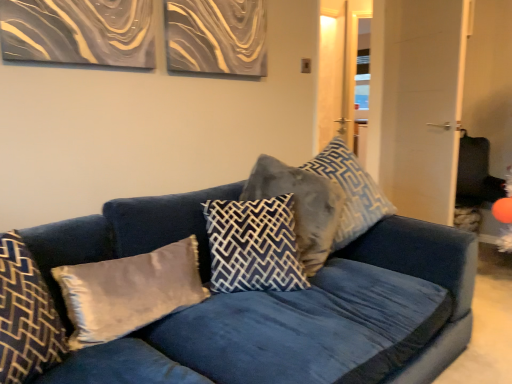
Question: Is velvet blue couch at center aimed at dark blue velvet pillow at center, which is the third pillow in left-to-right order?

Choices:
 (A) yes
 (B) no

Answer: (A)

Question: Is there a large distance between velvet blue couch at center and dark blue velvet pillow at center, the 3th pillow in the right-to-left sequence?

Choices:
 (A) yes
 (B) no

Answer: (B)

Question: Does velvet blue couch at center come in front of dark blue velvet pillow at center, the 3th pillow in the right-to-left sequence?

Choices:
 (A) no
 (B) yes

Answer: (B)

Question: Can you confirm if velvet blue couch at center is wider than dark blue velvet pillow at center, which is the third pillow in left-to-right order?

Choices:
 (A) yes
 (B) no

Answer: (A)

Question: From the image's perspective, would you say velvet blue couch at center is shown under dark blue velvet pillow at center, which is the third pillow in left-to-right order?

Choices:
 (A) yes
 (B) no

Answer: (A)

Question: Considering the relative sizes of velvet blue couch at center and dark blue velvet pillow at center, which is the third pillow in left-to-right order, in the image provided, is velvet blue couch at center shorter than dark blue velvet pillow at center, which is the third pillow in left-to-right order,?

Choices:
 (A) yes
 (B) no

Answer: (B)

Question: Considering the relative sizes of velvet blue pillow at center, the first pillow positioned from the right, and satin gray pillow at center, the second pillow from the left, in the image provided, is velvet blue pillow at center, the first pillow positioned from the right, wider than satin gray pillow at center, the second pillow from the left,?

Choices:
 (A) no
 (B) yes

Answer: (B)

Question: From a real-world perspective, is velvet blue pillow at center, acting as the 5th pillow starting from the left, positioned under satin gray pillow at center, arranged as the 4th pillow when viewed from the right, based on gravity?

Choices:
 (A) no
 (B) yes

Answer: (A)

Question: Can you confirm if velvet blue pillow at center, the first pillow positioned from the right, is shorter than satin gray pillow at center, arranged as the 4th pillow when viewed from the right?

Choices:
 (A) no
 (B) yes

Answer: (A)

Question: From a real-world perspective, is velvet blue pillow at center, the first pillow positioned from the right, on satin gray pillow at center, the second pillow from the left?

Choices:
 (A) no
 (B) yes

Answer: (B)

Question: From the image's perspective, is velvet blue pillow at center, acting as the 5th pillow starting from the left, beneath satin gray pillow at center, the second pillow from the left?

Choices:
 (A) no
 (B) yes

Answer: (A)

Question: Does velvet blue pillow at center, acting as the 5th pillow starting from the left, contain satin gray pillow at center, arranged as the 4th pillow when viewed from the right?

Choices:
 (A) yes
 (B) no

Answer: (B)

Question: From the image's perspective, does velvet blue pillow at center, acting as the 5th pillow starting from the left, appear higher than velvet blue couch at center?

Choices:
 (A) no
 (B) yes

Answer: (B)